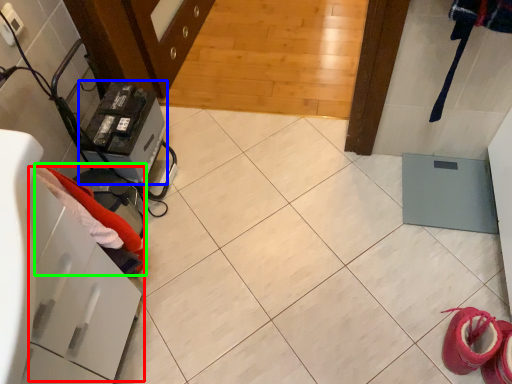
Question: Considering the real-world distances, which object is farthest from drawer (highlighted by a red box)? appliance (highlighted by a blue box) or clothing (highlighted by a green box)?

Choices:
 (A) appliance
 (B) clothing

Answer: (A)